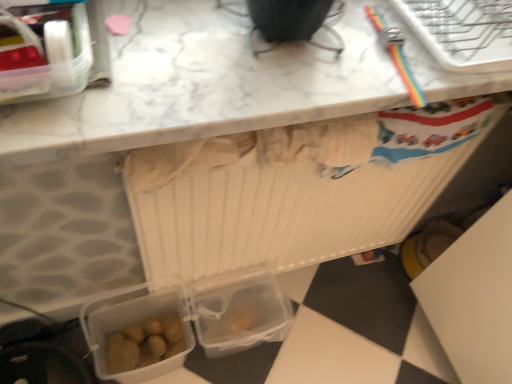
This screenshot has width=512, height=384. What are the coordinates of `free region on the left part of rainbow plastic bracelet at upper right` in the screenshot? It's located at (306, 48).